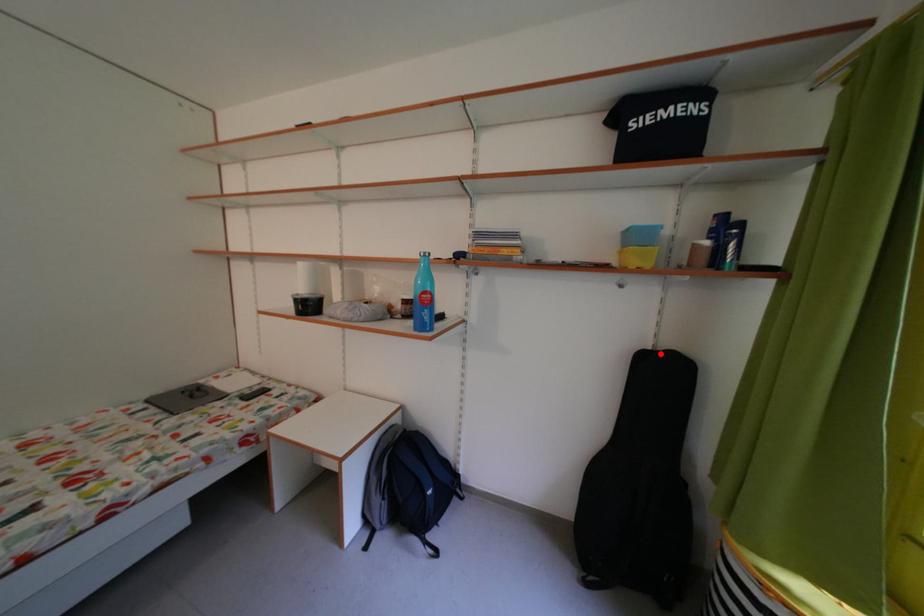
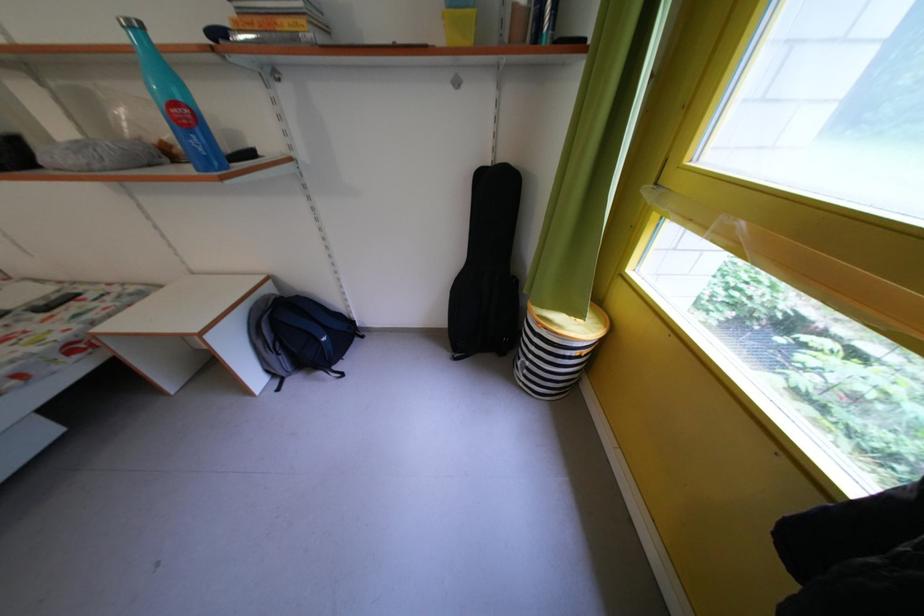
The point at the highlighted location is marked in the first image. Where is the corresponding point in the second image?

(499, 171)